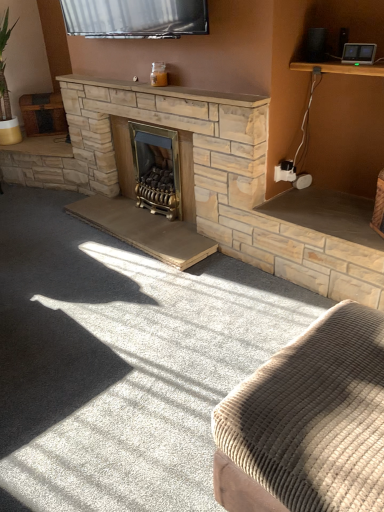
Question: Would you say corduroy fabric ottoman at lower right is inside or outside smooth stone mantle at upper center?

Choices:
 (A) outside
 (B) inside

Answer: (A)

Question: Relative to smooth stone mantle at upper center, is corduroy fabric ottoman at lower right in front or behind?

Choices:
 (A) behind
 (B) front

Answer: (B)

Question: Estimate the real-world distances between objects in this image. Which object is closer to the smooth stone mantle at upper center?

Choices:
 (A) corduroy fabric ottoman at lower right
 (B) gold metallic wood burning stove at center

Answer: (B)

Question: Which object is the farthest from the smooth stone mantle at upper center?

Choices:
 (A) gold metallic wood burning stove at center
 (B) corduroy fabric ottoman at lower right

Answer: (B)